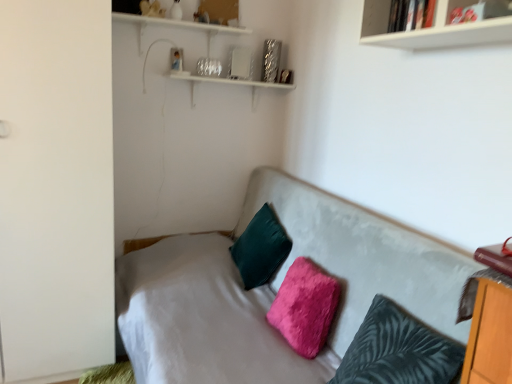
Question: Can white matte wardrobe at left be found inside fuzzy dark teal pillow at center, which is the 3th pillow from back to front?

Choices:
 (A) yes
 (B) no

Answer: (B)

Question: Considering the relative sizes of fuzzy dark teal pillow at center, which is counted as the first pillow, starting from the front, and white matte wardrobe at left in the image provided, is fuzzy dark teal pillow at center, which is counted as the first pillow, starting from the front, bigger than white matte wardrobe at left?

Choices:
 (A) yes
 (B) no

Answer: (B)

Question: Is there a large distance between fuzzy dark teal pillow at center, which is counted as the first pillow, starting from the front, and white matte wardrobe at left?

Choices:
 (A) yes
 (B) no

Answer: (A)

Question: Is fuzzy dark teal pillow at center, which is the 3th pillow from back to front, positioned with its back to white matte wardrobe at left?

Choices:
 (A) no
 (B) yes

Answer: (A)

Question: From a real-world perspective, is fuzzy dark teal pillow at center, which is the 3th pillow from back to front, located beneath white matte wardrobe at left?

Choices:
 (A) no
 (B) yes

Answer: (B)

Question: Is white matte wardrobe at left situated inside fuzzy dark teal pillow at center, which is the 3th pillow from back to front, or outside?

Choices:
 (A) inside
 (B) outside

Answer: (B)

Question: Is white matte wardrobe at left bigger or smaller than fuzzy dark teal pillow at center, which is the 3th pillow from back to front?

Choices:
 (A) small
 (B) big

Answer: (B)

Question: Considering the positions of white matte wardrobe at left and fuzzy dark teal pillow at center, which is the 3th pillow from back to front, in the image, is white matte wardrobe at left taller or shorter than fuzzy dark teal pillow at center, which is the 3th pillow from back to front,?

Choices:
 (A) tall
 (B) short

Answer: (A)

Question: Is white matte wardrobe at left wider or thinner than fuzzy dark teal pillow at center, which is the 3th pillow from back to front?

Choices:
 (A) thin
 (B) wide

Answer: (B)

Question: From the image's perspective, is fuzzy dark teal pillow at center, which is counted as the first pillow, starting from the front, above or below velvet green pillow at center, which is the 1th pillow in back-to-front order?

Choices:
 (A) above
 (B) below

Answer: (B)

Question: Considering the positions of fuzzy dark teal pillow at center, which is the 3th pillow from back to front, and velvet green pillow at center, which is the 1th pillow in back-to-front order, in the image, is fuzzy dark teal pillow at center, which is the 3th pillow from back to front, wider or thinner than velvet green pillow at center, which is the 1th pillow in back-to-front order,?

Choices:
 (A) wide
 (B) thin

Answer: (B)

Question: From a real-world perspective, is fuzzy dark teal pillow at center, which is the 3th pillow from back to front, positioned above or below velvet green pillow at center, which is the 1th pillow in back-to-front order?

Choices:
 (A) above
 (B) below

Answer: (B)

Question: Considering the positions of fuzzy dark teal pillow at center, which is counted as the first pillow, starting from the front, and velvet green pillow at center, which is the third pillow from front to back, in the image, is fuzzy dark teal pillow at center, which is counted as the first pillow, starting from the front, taller or shorter than velvet green pillow at center, which is the third pillow from front to back,?

Choices:
 (A) short
 (B) tall

Answer: (A)

Question: In terms of size, does fuzzy pink pillow at center, placed as the second pillow when sorted from back to front, appear bigger or smaller than fuzzy dark teal pillow at center, which is the 3th pillow from back to front?

Choices:
 (A) small
 (B) big

Answer: (A)

Question: Is fuzzy pink pillow at center, placed as the second pillow when sorted from back to front, situated inside fuzzy dark teal pillow at center, which is the 3th pillow from back to front, or outside?

Choices:
 (A) inside
 (B) outside

Answer: (B)